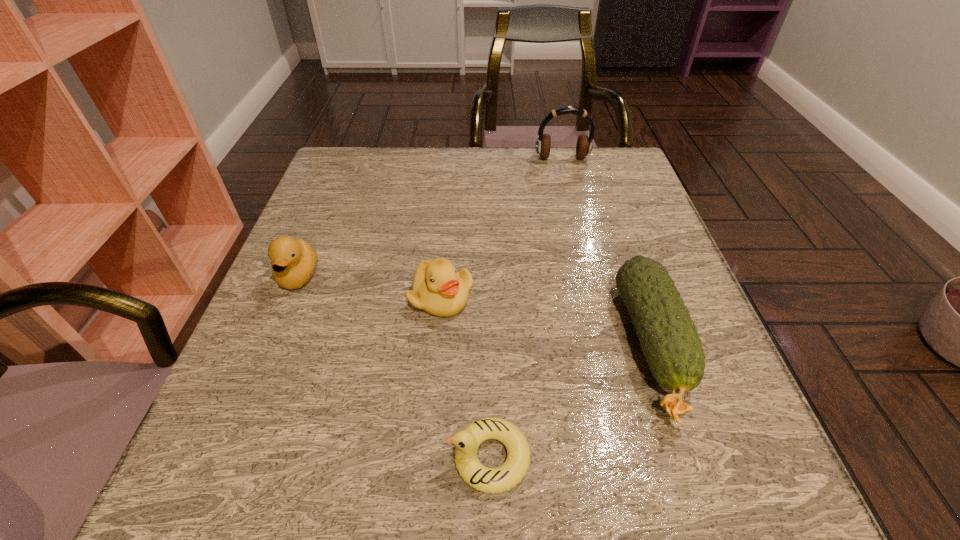
Locate an element on the screen. free space located on the face of the nearest duckling is located at coordinates (195, 457).

Find the location of a particular element. Image resolution: width=960 pixels, height=540 pixels. object located in the far edge section of the desktop is located at coordinates (584, 145).

This screenshot has width=960, height=540. Identify the location of object present at the near edge. (488, 480).

The width and height of the screenshot is (960, 540). What are the coordinates of `object that is at the left edge` in the screenshot? It's located at (293, 261).

Where is `headset present at the right edge`? The height and width of the screenshot is (540, 960). headset present at the right edge is located at coordinates click(584, 145).

Where is `cucumber that is at the right edge`? cucumber that is at the right edge is located at coordinates (669, 340).

In order to click on object that is at the far right corner in this screenshot , I will do `click(584, 145)`.

Where is `blank space at the far edge`? blank space at the far edge is located at coordinates (523, 197).

The height and width of the screenshot is (540, 960). What are the coordinates of `vacant space at the near edge` in the screenshot? It's located at (444, 461).

Identify the location of free location at the left edge. (277, 421).